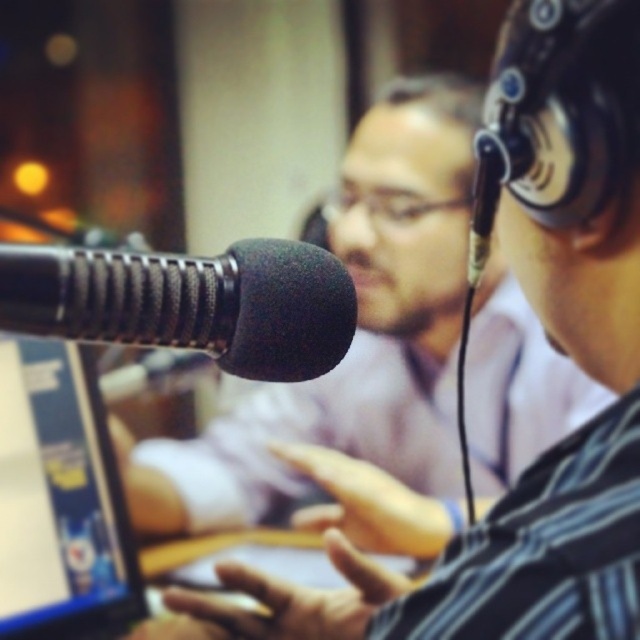
Question: Among these points, which one is nearest to the camera?

Choices:
 (A) click(x=225, y=307)
 (B) click(x=483, y=228)

Answer: (A)

Question: From the image, what is the correct spatial relationship of black fabric microphone at left in relation to matte plastic laptop at left?

Choices:
 (A) below
 (B) above

Answer: (B)

Question: In this image, where is matte plastic laptop at left located relative to black foam microphone at center?

Choices:
 (A) right
 (B) left

Answer: (B)

Question: Considering the real-world distances, which object is farthest from the matte plastic laptop at left?

Choices:
 (A) black fabric microphone at left
 (B) black foam microphone at center

Answer: (B)

Question: Considering the real-world distances, which object is closest to the black fabric microphone at left?

Choices:
 (A) black foam microphone at center
 (B) matte plastic laptop at left

Answer: (A)

Question: Can you confirm if matte plastic laptop at left is wider than black foam microphone at center?

Choices:
 (A) no
 (B) yes

Answer: (B)